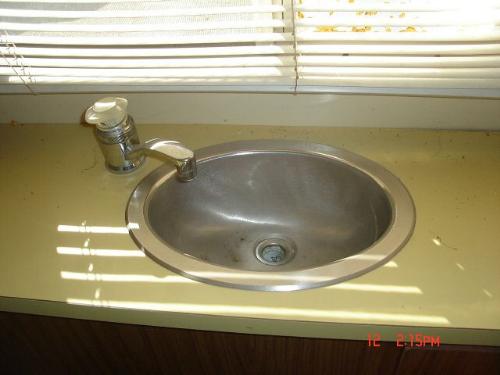
Where is `light streaming through blind`? This screenshot has height=375, width=500. light streaming through blind is located at coordinates (90, 228).